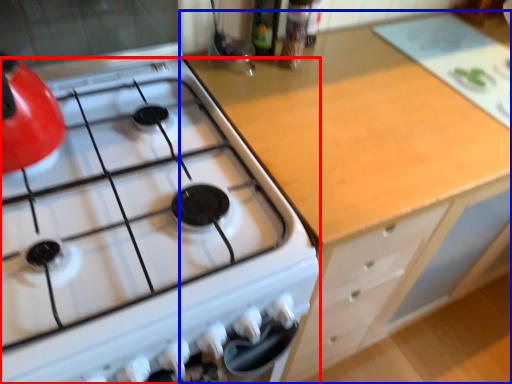
Question: Among these objects, which one is nearest to the camera, gas stove (highlighted by a red box) or cabinetry (highlighted by a blue box)?

Choices:
 (A) gas stove
 (B) cabinetry

Answer: (A)